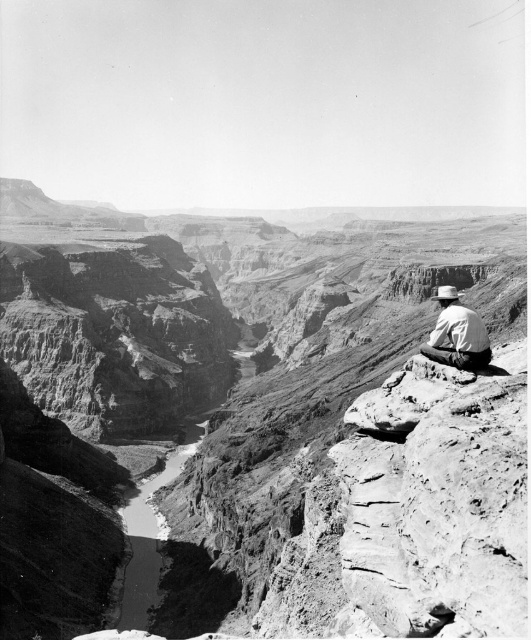
From the picture: You are a photographer trying to capture the rugged rock canyon at center and the white felt cowboy hat at right in a single shot. Can you ensure both are visible in your frame without moving the camera?

The white felt cowboy hat at right is behind the rugged rock canyon at center, so the rugged rock canyon at center may block the view of the white felt cowboy hat at right in the frame. Adjust your position or angle to ensure both are visible.

You are standing at the point marked by the coordinates point (457, 333) in the canyon image. Looking around, you see the rugged canyon walls and the person seated on the rocky outcrop. What object is directly beneath your feet at this point?

The point (457, 333) is located on the light brown leather hat at center, so the object directly beneath your feet is the light brown leather hat at center.

In the scene shown: You are a photographer planning to capture the rugged rock canyon at center and the white felt cowboy hat at right in a single frame. Based on their sizes in the scene, which object will appear larger in your photo?

The rugged rock canyon at center will appear larger in the photo because it is taller than the white felt cowboy hat at right.